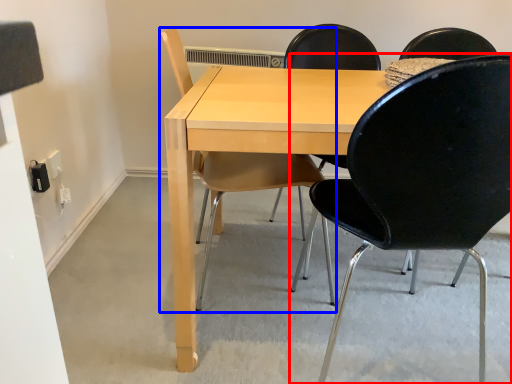
Question: Among these objects, which one is farthest to the camera, chair (highlighted by a red box) or chair (highlighted by a blue box)?

Choices:
 (A) chair
 (B) chair

Answer: (B)